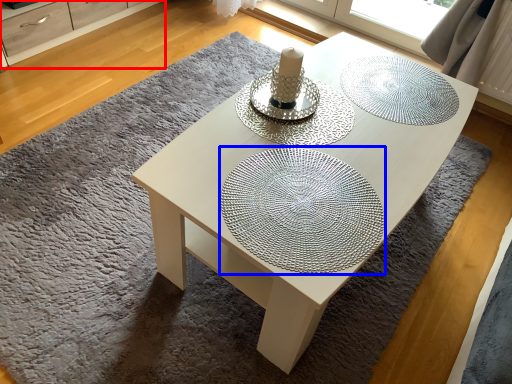
Question: Which of the following is the closest to the observer, dresser (highlighted by a red box) or glass plate (highlighted by a blue box)?

Choices:
 (A) dresser
 (B) glass plate

Answer: (B)